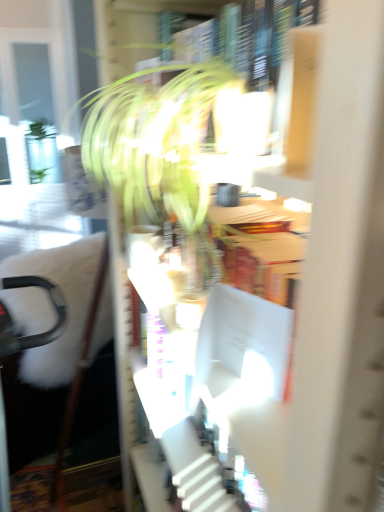
Question: In the image, is black plastic swivel chair at left on the left side or the right side of white cardboard bookcase at center?

Choices:
 (A) right
 (B) left

Answer: (B)

Question: From their relative heights in the image, would you say black plastic swivel chair at left is taller or shorter than white cardboard bookcase at center?

Choices:
 (A) short
 (B) tall

Answer: (B)

Question: Which object is the closest to the white cardboard bookcase at center?

Choices:
 (A) black plastic swivel chair at left
 (B) green leafy plant at center

Answer: (B)

Question: Estimate the real-world distances between objects in this image. Which object is farther from the black plastic swivel chair at left?

Choices:
 (A) green leafy plant at center
 (B) white cardboard bookcase at center

Answer: (B)